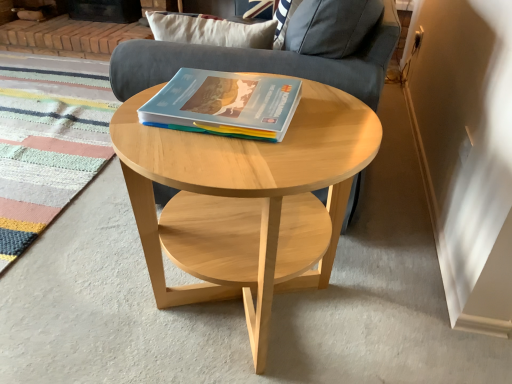
You are a GUI agent. You are given a task and a screenshot of the screen. Output one action in this format:
    pyautogui.click(x=<x>, y=<y>)
    Task: Click on the vacant space situated above multicolored woven mat at lower left (from a real-world perspective)
    The width and height of the screenshot is (512, 384).
    Given the screenshot: What is the action you would take?
    pyautogui.click(x=41, y=116)